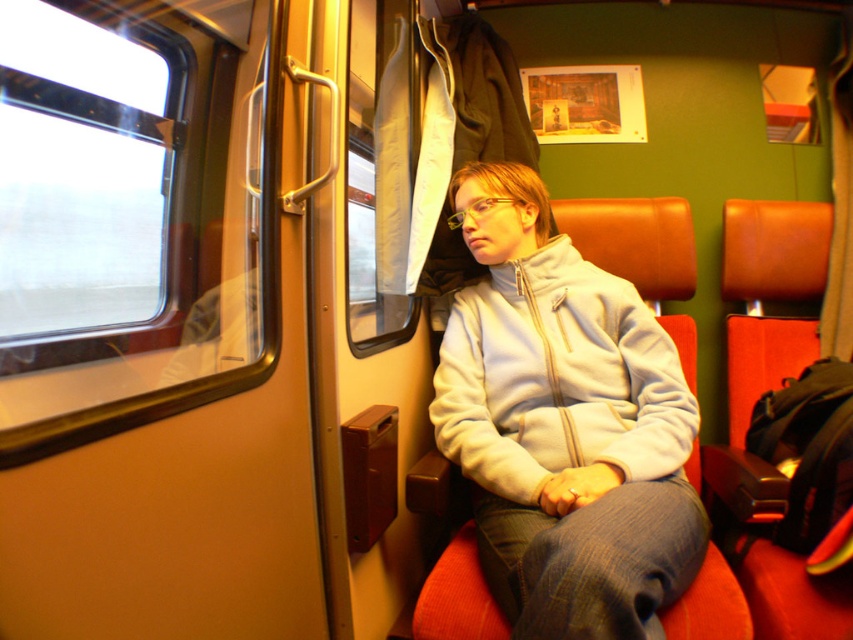
Question: Does transparent glass window at left have a larger size compared to white fleece sweatshirt at center?

Choices:
 (A) yes
 (B) no

Answer: (A)

Question: Which object appears farthest from the camera in this image?

Choices:
 (A) transparent glass window at left
 (B) white fleece sweatshirt at center

Answer: (B)

Question: Among these points, which one is nearest to the camera?

Choices:
 (A) (360, 90)
 (B) (51, 349)

Answer: (B)

Question: Where is transparent glass window at left located in relation to white fleece sweatshirt at center in the image?

Choices:
 (A) below
 (B) above

Answer: (B)

Question: Is transparent glass window at left positioned in front of white fleece sweatshirt at center?

Choices:
 (A) yes
 (B) no

Answer: (A)

Question: Which object appears closest to the camera in this image?

Choices:
 (A) transparent glass window at left
 (B) white fleece sweatshirt at center

Answer: (A)